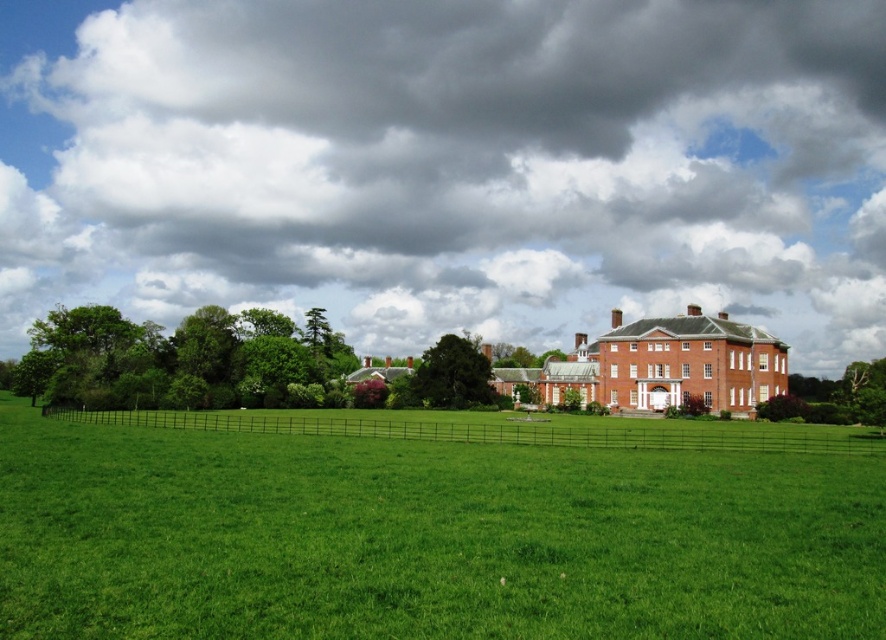
You are standing in front of the building and looking towards the green grass at center. Which direction should you walk to face the dark gray cloud at upper center?

The dark gray cloud at upper center is positioned on the right side of green grass at center. Since you are facing the green grass at center, turning to your right will orient you towards the dark gray cloud at upper center.

You are standing in front of the large red brick building and want to walk from the green leafy tree at left to the green leafy tree at center. Which direction should you face to walk directly towards the second tree?

You should face to the right because the green leafy tree at left is to the left of the green leafy tree at center, so moving towards the right will lead you directly towards the second tree.

You are standing in front of the building and looking towards the sky. Which object, the dark gray cloud at upper center or the green grass at center, is above the other?

The dark gray cloud at upper center is positioned over green grass at center, so the dark gray cloud at upper center is above the green grass at center.